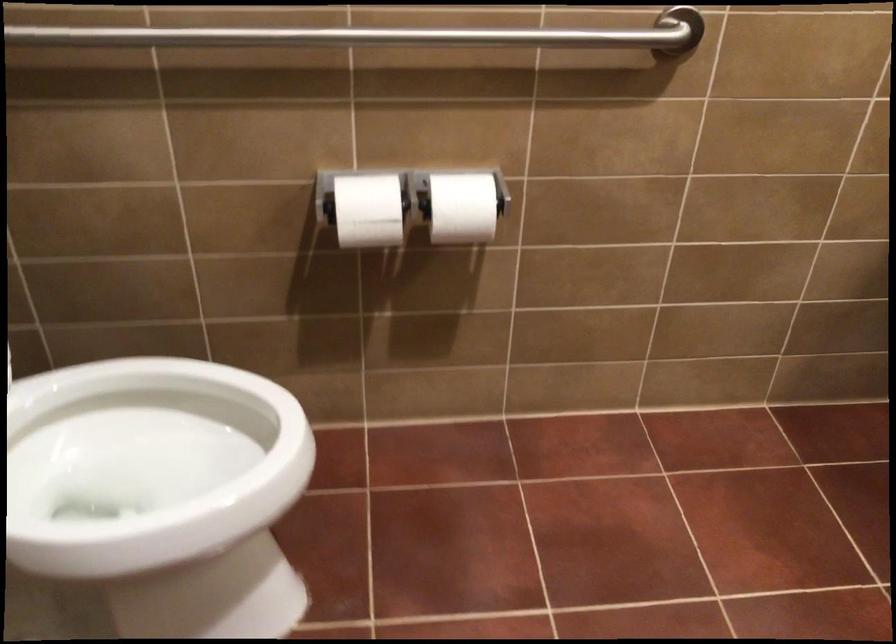
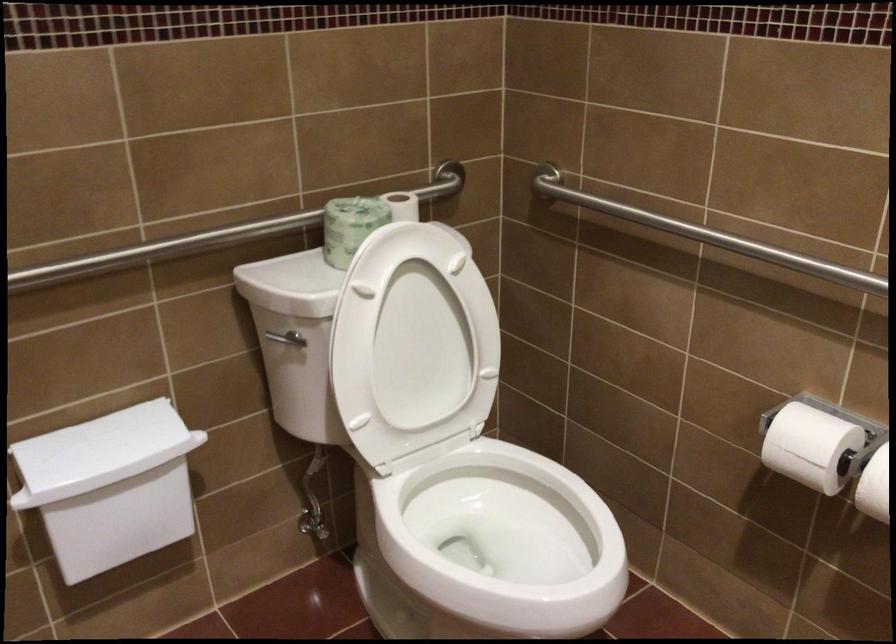
The point at (376,214) is marked in the first image. Where is the corresponding point in the second image?

(810, 446)